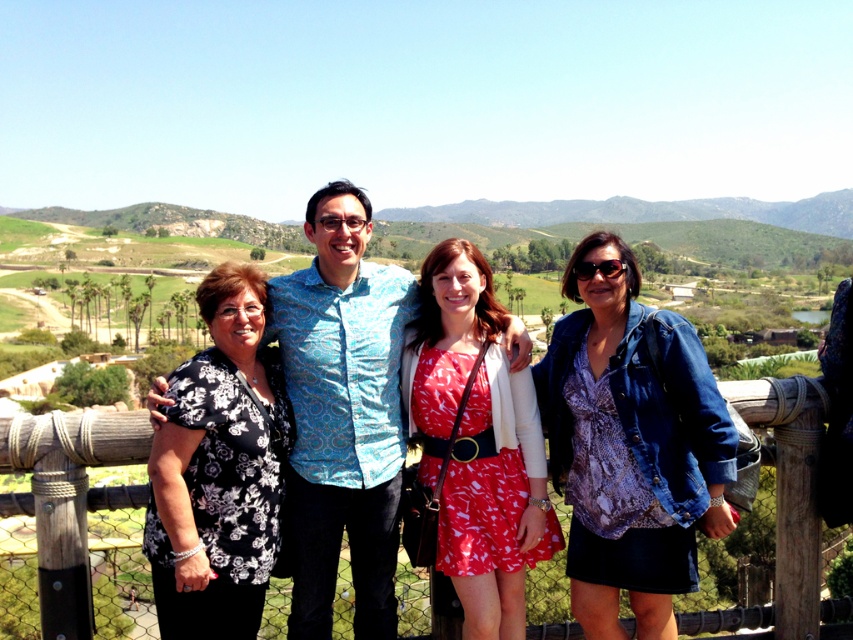
Question: Which object is farther from the camera taking this photo?

Choices:
 (A) wooden fence at center
 (B) denim jacket at right

Answer: (B)

Question: Considering the relative positions of blue patterned shirt at center and printed cotton dress at center in the image provided, where is blue patterned shirt at center located with respect to printed cotton dress at center?

Choices:
 (A) left
 (B) right

Answer: (A)

Question: Which point is farther from the camera taking this photo?

Choices:
 (A) (x=544, y=509)
 (B) (x=666, y=536)
 (C) (x=175, y=417)
 (D) (x=312, y=385)

Answer: (D)

Question: Is blue patterned shirt at center behind printed cotton dress at center?

Choices:
 (A) no
 (B) yes

Answer: (A)

Question: Which object appears farthest from the camera in this image?

Choices:
 (A) denim jacket at right
 (B) printed cotton dress at center

Answer: (B)

Question: Can you confirm if black floral blouse at left is positioned above wooden fence at center?

Choices:
 (A) no
 (B) yes

Answer: (B)